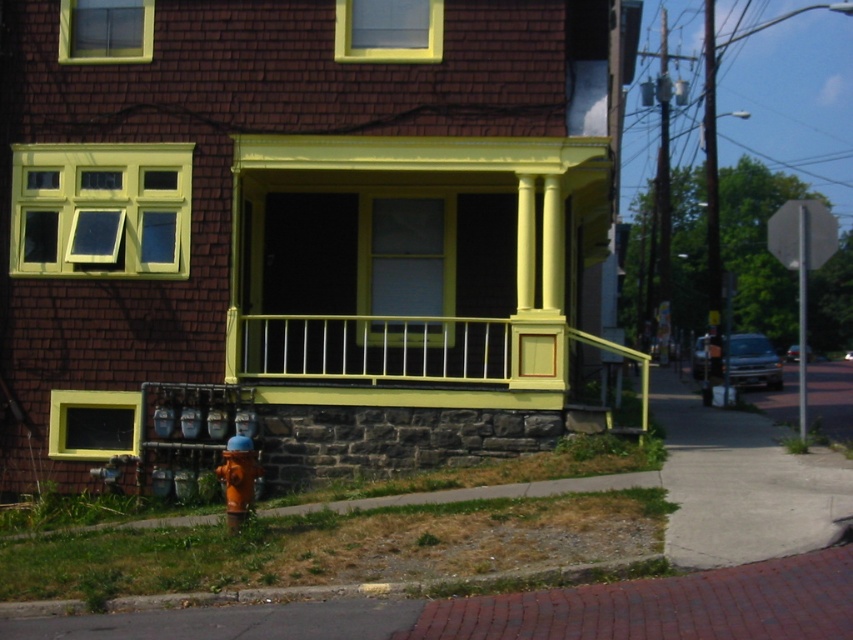
You are standing on the brick pavement at lower right and want to walk to the orange matte hydrant at lower left. Which direction should you move to reach it?

The brick pavement at lower right is in front of the orange matte hydrant at lower left, so you should move backward to reach the hydrant.